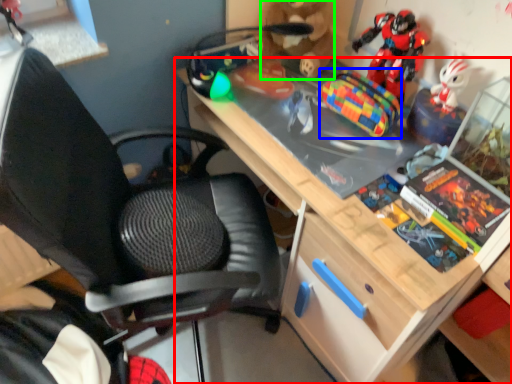
Question: Based on their relative distances, which object is farther from desk (highlighted by a red box)? Choose from toy (highlighted by a blue box) and toy (highlighted by a green box).

Choices:
 (A) toy
 (B) toy

Answer: (B)